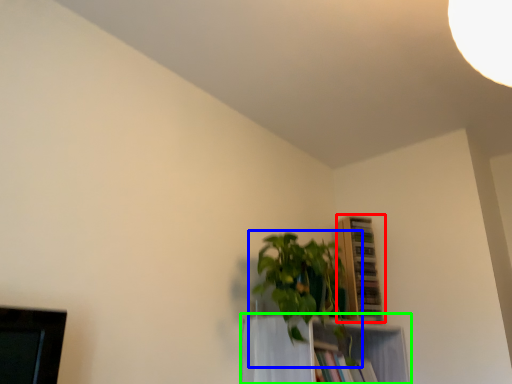
Question: Which object is the closest to the shelf (highlighted by a red box)? Choose among these: houseplant (highlighted by a blue box) or shelf (highlighted by a green box).

Choices:
 (A) houseplant
 (B) shelf

Answer: (B)